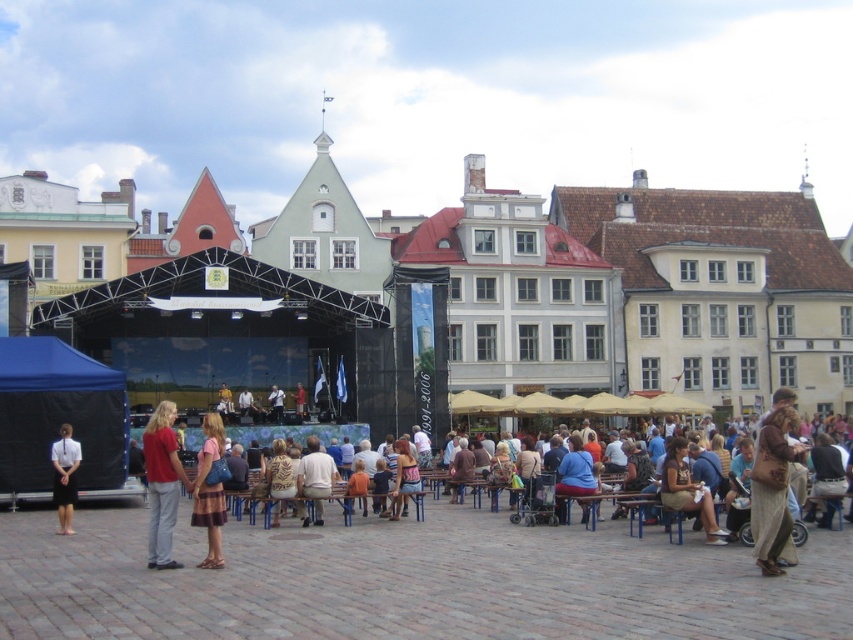
Question: Can you confirm if light brown leather jacket at center is thinner than white shirt at left?

Choices:
 (A) yes
 (B) no

Answer: (B)

Question: Observing the image, what is the correct spatial positioning of brown textured bag at lower right in reference to brown leather bag at lower right?

Choices:
 (A) left
 (B) right

Answer: (B)

Question: Which of the following is the farthest from the observer?

Choices:
 (A) (215, 412)
 (B) (167, 465)

Answer: (A)

Question: Which point appears closest to the camera in this image?

Choices:
 (A) (213, 525)
 (B) (305, 512)

Answer: (A)

Question: Which of the following is the closest to the observer?

Choices:
 (A) brown textured bag at lower right
 (B) black matte stage at center

Answer: (A)

Question: Does black matte stage at center have a larger size compared to white shirt at left?

Choices:
 (A) yes
 (B) no

Answer: (A)